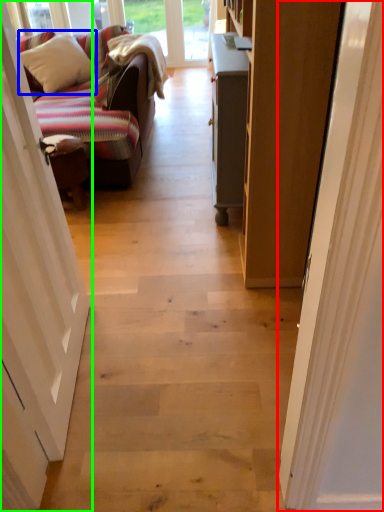
Question: Considering the real-world distances, which object is farthest from door (highlighted by a red box)? pillow (highlighted by a blue box) or door (highlighted by a green box)?

Choices:
 (A) pillow
 (B) door

Answer: (A)